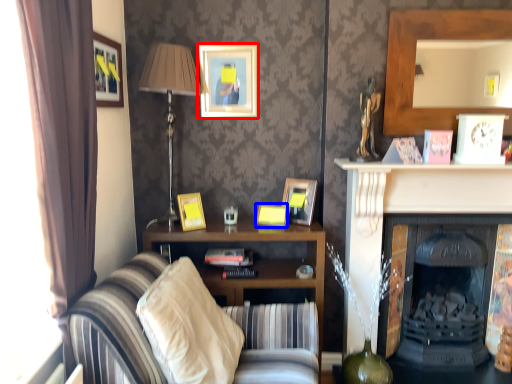
Question: Which point is closer to the camera, picture frame (highlighted by a red box) or picture frame (highlighted by a blue box)?

Choices:
 (A) picture frame
 (B) picture frame

Answer: (B)